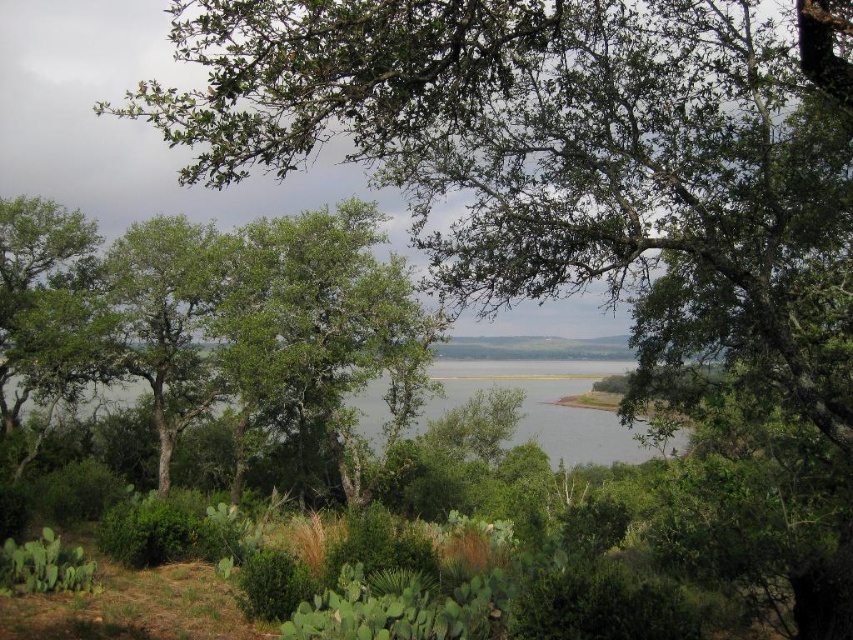
You are standing at the center of the image and want to walk towards the green leafy tree at center. Which direction should you face to head directly towards it?

Since the green leafy tree at center is located at point coordinates, you should face directly forward as it is already centered in your view.

You are a hiker standing at the base of the green leafy tree at center. You want to cross the body of water in the middle ground. There is a fallen log that is 20 meters long. Will the log reach from the tree to the water?

The distance between the green leafy tree at center and the body of water is 22.22 meters. The log is only 20 meters long, so it will not be long enough to span the gap between the green leafy tree at center and the water.

You are standing in the natural landscape described and want to see what is beyond the green leafy tree at center. Since the green leafy water at center is behind it, can you see the water through the tree?

The green leafy water at center is behind the green leafy tree at center, so yes, you can see the water through the tree as it is positioned behind the tree.